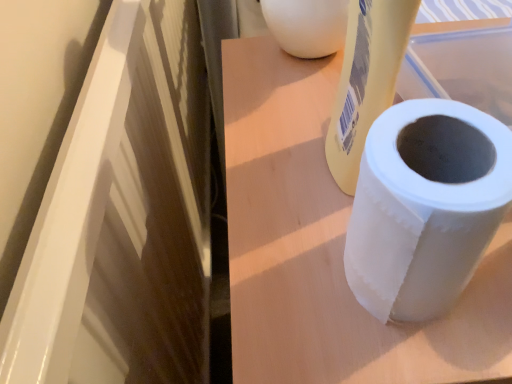
Question: From the image's perspective, is white matte paper towel roll at center positioned above or below white matte toilet paper at right?

Choices:
 (A) above
 (B) below

Answer: (B)

Question: Is white matte paper towel roll at center inside or outside of white matte toilet paper at right?

Choices:
 (A) outside
 (B) inside

Answer: (A)

Question: Visually, is white matte paper towel roll at center positioned to the left or to the right of white matte toilet paper at right?

Choices:
 (A) right
 (B) left

Answer: (A)

Question: Would you say white matte toilet paper at right is to the left or to the right of white matte paper towel roll at center in the picture?

Choices:
 (A) left
 (B) right

Answer: (A)

Question: Relative to white matte paper towel roll at center, is white matte toilet paper at right in front or behind?

Choices:
 (A) behind
 (B) front

Answer: (B)

Question: Do you think white matte toilet paper at right is within white matte paper towel roll at center, or outside of it?

Choices:
 (A) inside
 (B) outside

Answer: (B)

Question: Is white matte toilet paper at right bigger or smaller than white matte paper towel roll at center?

Choices:
 (A) big
 (B) small

Answer: (B)